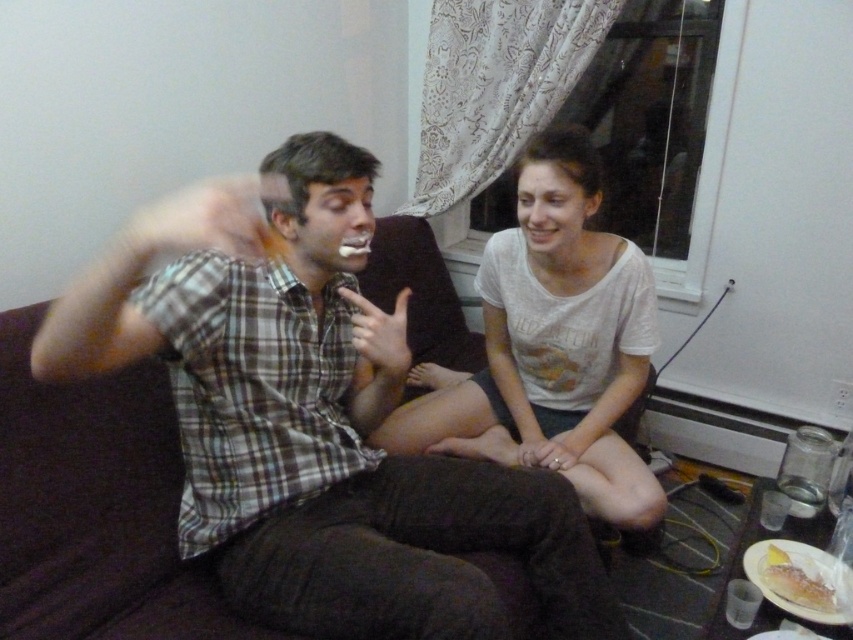
Question: Can you confirm if white cotton shirt at center is positioned to the right of yellow cake at lower right?

Choices:
 (A) yes
 (B) no

Answer: (B)

Question: Is white cotton shirt at center bigger than yellow cake at lower right?

Choices:
 (A) yes
 (B) no

Answer: (A)

Question: Is plaid shirt at center further to the viewer compared to white cotton shirt at center?

Choices:
 (A) yes
 (B) no

Answer: (B)

Question: Which of the following is the closest to the observer?

Choices:
 (A) (822, 602)
 (B) (216, 369)
 (C) (425, 413)

Answer: (B)

Question: Which of these objects is positioned closest to the plaid shirt at center?

Choices:
 (A) yellow cake at lower right
 (B) white cotton shirt at center

Answer: (B)

Question: Which object is the farthest from the white cotton shirt at center?

Choices:
 (A) plaid shirt at center
 (B) yellow cake at lower right

Answer: (B)